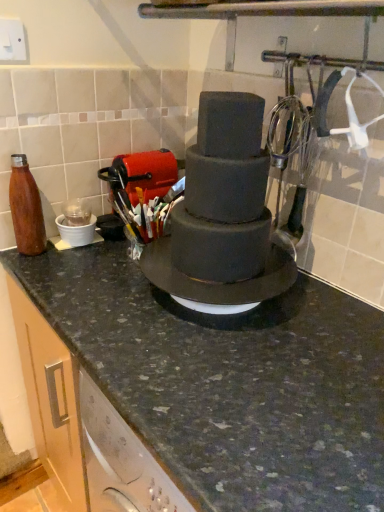
Question: Is smooth matte chocolate cake at center further to camera compared to granite countertop at center?

Choices:
 (A) no
 (B) yes

Answer: (B)

Question: Is smooth matte chocolate cake at center completely or partially outside of granite countertop at center?

Choices:
 (A) no
 (B) yes

Answer: (B)

Question: Is smooth matte chocolate cake at center next to granite countertop at center and touching it?

Choices:
 (A) yes
 (B) no

Answer: (B)

Question: Does smooth matte chocolate cake at center have a larger size compared to granite countertop at center?

Choices:
 (A) yes
 (B) no

Answer: (B)

Question: Is smooth matte chocolate cake at center thinner than granite countertop at center?

Choices:
 (A) yes
 (B) no

Answer: (A)

Question: Do you think matte brown bottle at left is within granite countertop at center, or outside of it?

Choices:
 (A) inside
 (B) outside

Answer: (B)

Question: Is point (23, 223) positioned closer to the camera than point (249, 407)?

Choices:
 (A) closer
 (B) farther

Answer: (B)

Question: Considering the positions of matte brown bottle at left and granite countertop at center in the image, is matte brown bottle at left taller or shorter than granite countertop at center?

Choices:
 (A) short
 (B) tall

Answer: (A)

Question: In terms of width, does matte brown bottle at left look wider or thinner when compared to granite countertop at center?

Choices:
 (A) wide
 (B) thin

Answer: (B)

Question: Considering the positions of granite countertop at center and smooth matte chocolate cake at center in the image, is granite countertop at center bigger or smaller than smooth matte chocolate cake at center?

Choices:
 (A) small
 (B) big

Answer: (B)

Question: Does point (345, 296) appear closer or farther from the camera than point (205, 155)?

Choices:
 (A) farther
 (B) closer

Answer: (A)

Question: Considering the positions of granite countertop at center and smooth matte chocolate cake at center in the image, is granite countertop at center wider or thinner than smooth matte chocolate cake at center?

Choices:
 (A) thin
 (B) wide

Answer: (B)

Question: From the image's perspective, is granite countertop at center located above or below smooth matte chocolate cake at center?

Choices:
 (A) below
 (B) above

Answer: (A)

Question: Is smooth matte chocolate cake at center situated inside matte brown bottle at left or outside?

Choices:
 (A) outside
 (B) inside

Answer: (A)

Question: Based on their sizes in the image, would you say smooth matte chocolate cake at center is bigger or smaller than matte brown bottle at left?

Choices:
 (A) small
 (B) big

Answer: (B)